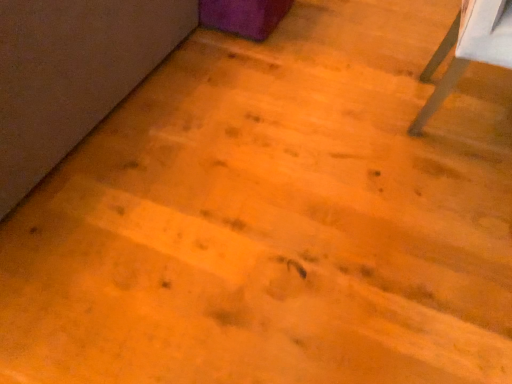
At what (x,y) coordinates should I click in order to perform the action: click on vacant space underneath wooden table at right (from a real-world perspective). Please return your answer as a coordinate pair (x, y). This screenshot has height=384, width=512. Looking at the image, I should click on (457, 107).